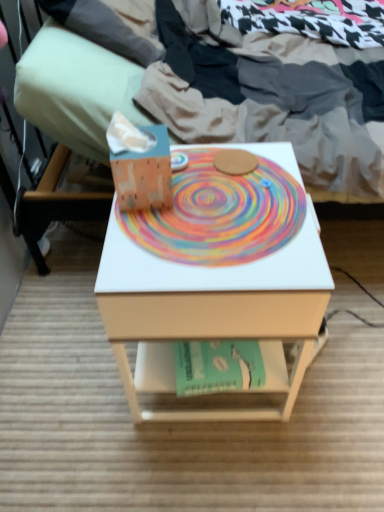
What are the coordinates of `vacant space in rainbow painted paper at center (from a real-world perspective)` in the screenshot? It's located at (222, 207).